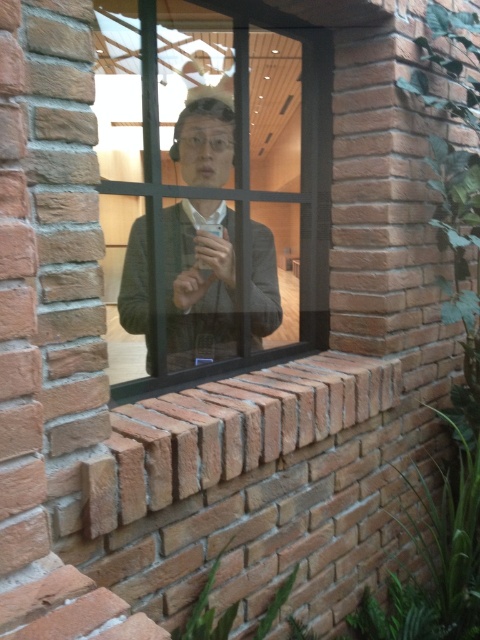
You are standing outside the brick wall and want to see the person inside the building through the clear glass window at center. Can you see the matte black jacket at center from your current position?

The clear glass window at center is above the matte black jacket at center, so yes, you can see the matte black jacket at center through the window since it is positioned below the window.

You are standing in front of a brick wall and want to touch both the clear glass window at center and the matte black jacket at center. Which object will you reach first?

The clear glass window at center is closer to the viewer than the matte black jacket at center, so you will reach the clear glass window at center first.